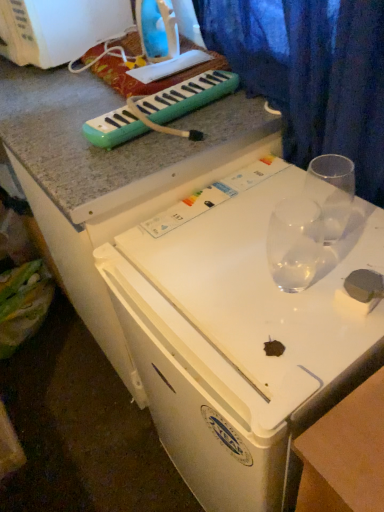
Identify the location of vacant area that is in front of transparent glass at upper right, which is the first martini glass in right-to-left order. The image size is (384, 512). (319, 303).